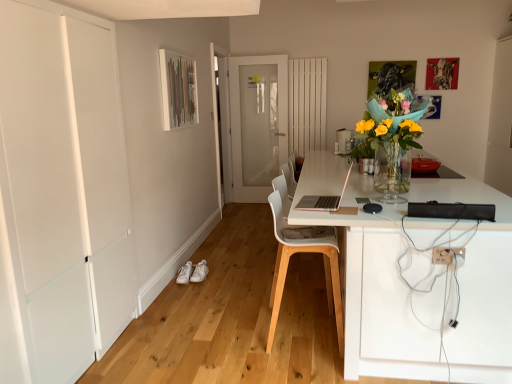
Question: From a real-world perspective, is white plastic chair at center positioned above or below white leather shoe at lower center, the 2th shoe from the left?

Choices:
 (A) below
 (B) above

Answer: (B)

Question: Considering the positions of white plastic chair at center and white leather shoe at lower center, the 2th shoe from the left, in the image, is white plastic chair at center taller or shorter than white leather shoe at lower center, the 2th shoe from the left,?

Choices:
 (A) short
 (B) tall

Answer: (B)

Question: Which object is the closest to the white leather shoe at lower left, which is counted as the first shoe, starting from the left?

Choices:
 (A) white plastic chair at center
 (B) white plastic electric outlet at lower right
 (C) white frosted glass door at center, the 2th door viewed from the front
 (D) white matte door at left, the first door viewed from the left
 (E) white leather shoe at lower center, the 2th shoe from the left

Answer: (E)

Question: Which object is the farthest from the white frosted glass door at center, the 2th door viewed from the front?

Choices:
 (A) white matte door at left, the first door viewed from the left
 (B) white plastic chair at center
 (C) white plastic electric outlet at lower right
 (D) white leather shoe at lower center, placed as the 1th shoe when sorted from right to left
 (E) white leather shoe at lower left, which is counted as the second shoe, starting from the right

Answer: (C)